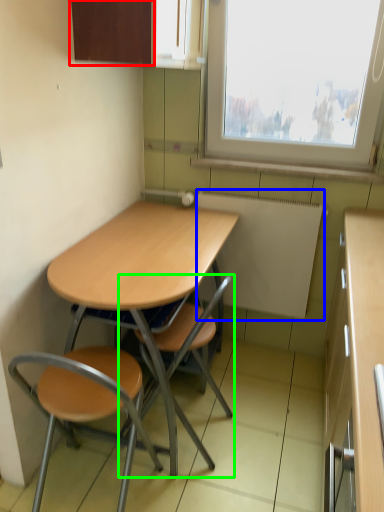
Question: Which is farther away from cabinetry (highlighted by a red box)? appliance (highlighted by a blue box) or chair (highlighted by a green box)?

Choices:
 (A) appliance
 (B) chair

Answer: (B)